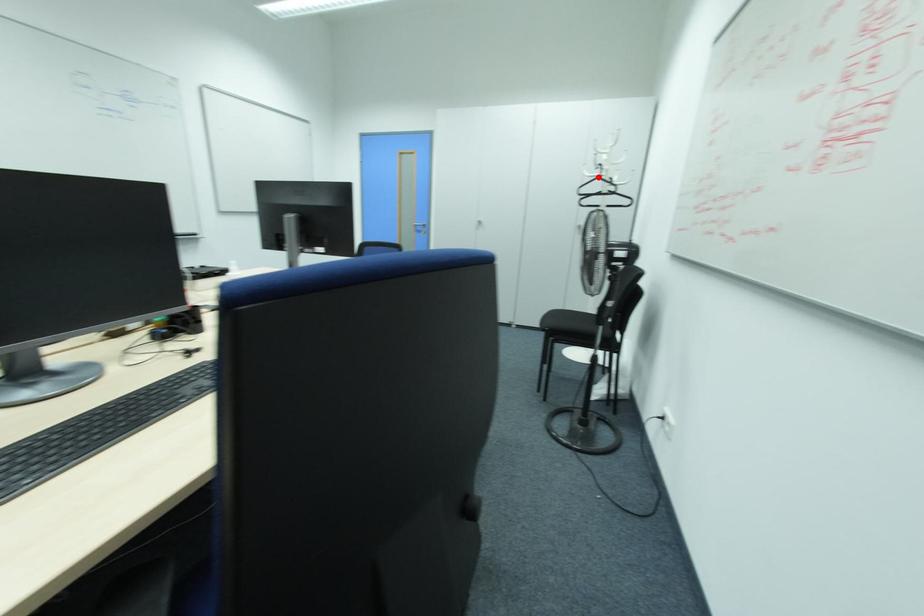
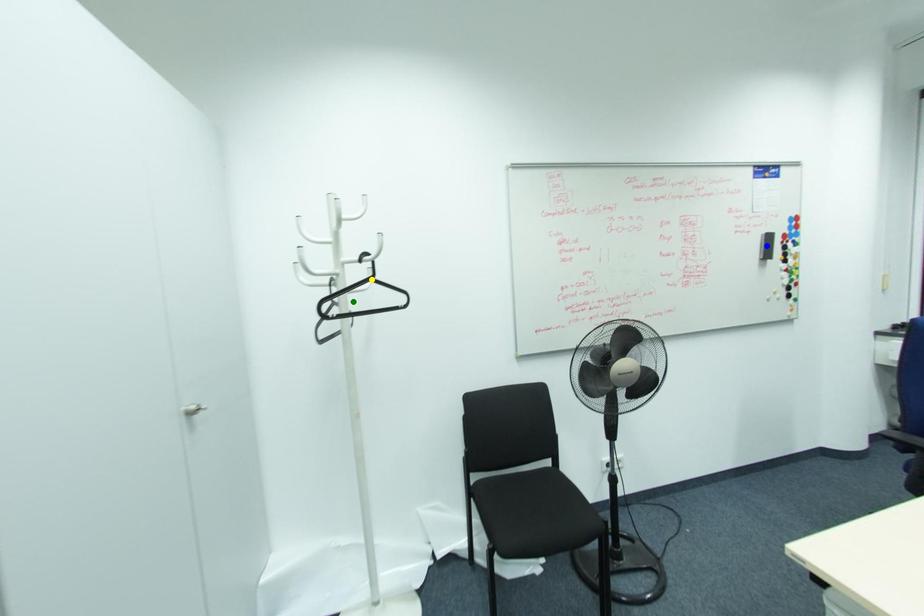
Question: I am providing you with two images of the same scene from different viewpoints. A red point is marked on the first image. You are given multiple points on the second image. Which spot in image 2 lines up with the point in image 1?

Choices:
 (A) yellow point
 (B) blue point
 (C) green point

Answer: (A)